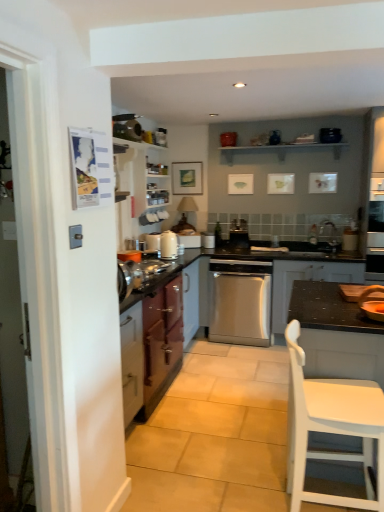
This screenshot has height=512, width=384. I want to click on vacant space situated on the left part of wooden bowl at right, which is the 1th appliance in right-to-left order, so click(x=345, y=320).